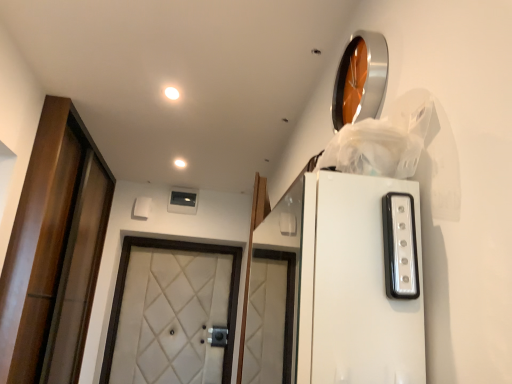
Question: Looking at their shapes, would you say white matte light fixture at upper center, which is the 1th lighting from left to right, is wider or thinner than white glossy light strip at upper right?

Choices:
 (A) wide
 (B) thin

Answer: (A)

Question: Considering their positions, is white matte light fixture at upper center, positioned as the second lighting in top-to-bottom order, located in front of or behind white glossy light strip at upper right?

Choices:
 (A) behind
 (B) front

Answer: (A)

Question: Which object is the farthest from the white glossy light strip at upper right?

Choices:
 (A) brown wooden door at left, which ranks as the second door in right-to-left order
 (B) white matte light fixture at upper center, the first lighting from the back
 (C) matte white light fixture at upper center, the 2th lighting viewed from the back
 (D) white quilted fabric door at center, the first door when ordered from right to left

Answer: (D)

Question: Which object is positioned farthest from the white glossy light strip at upper right?

Choices:
 (A) white quilted fabric door at center, acting as the second door starting from the left
 (B) brown wooden door at left, marked as the 1th door in a left-to-right arrangement
 (C) matte white light fixture at upper center, marked as the 1th lighting in a right-to-left arrangement
 (D) white matte light fixture at upper center, the 1th lighting positioned from the bottom

Answer: (A)